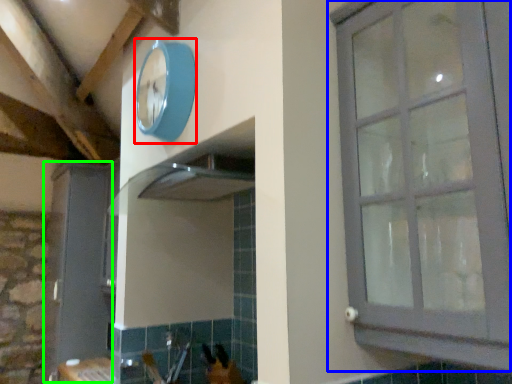
Question: Which is nearer to the clock (highlighted by a red box)? window (highlighted by a blue box) or screen door (highlighted by a green box).

Choices:
 (A) window
 (B) screen door

Answer: (A)